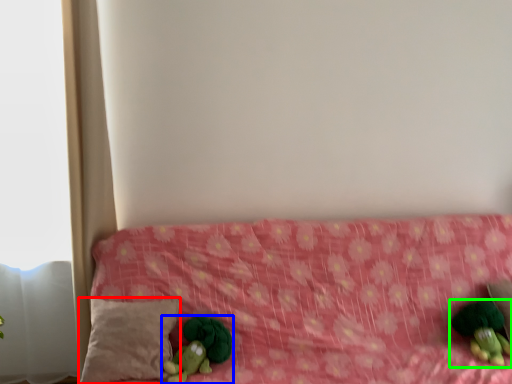
Question: Which object is positioned farthest from pillow (highlighted by a red box)? Select from toy (highlighted by a blue box) and toy (highlighted by a green box).

Choices:
 (A) toy
 (B) toy

Answer: (B)